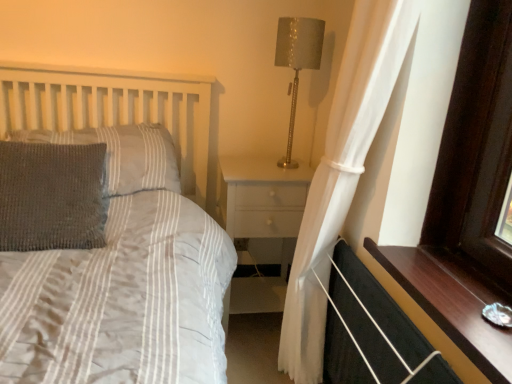
Where is `vacant region above dark wood window sill at lower right (from a real-world perspective)`? vacant region above dark wood window sill at lower right (from a real-world perspective) is located at coordinates (456, 284).